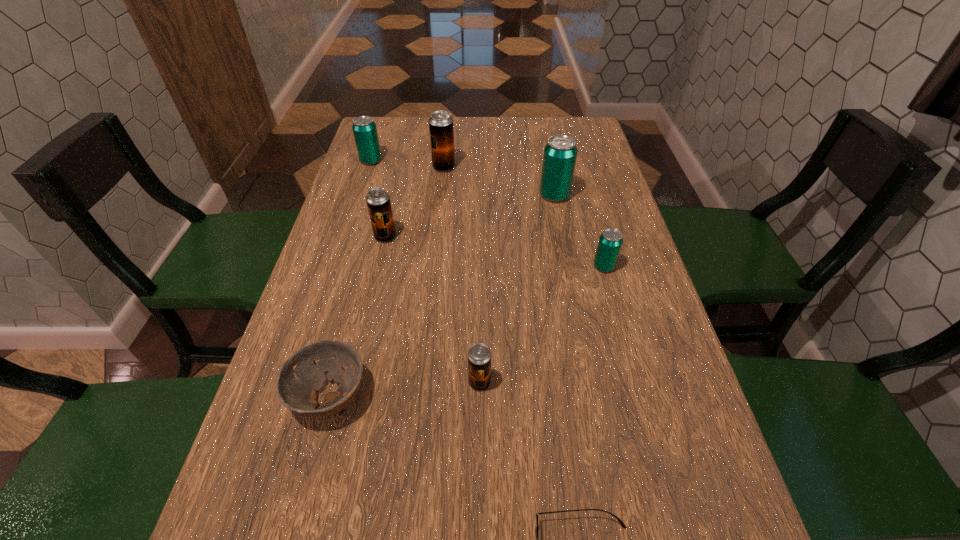
This screenshot has height=540, width=960. I want to click on the third beer can from right to left, so click(479, 355).

Where is `the nearest black beer can`? The height and width of the screenshot is (540, 960). the nearest black beer can is located at coordinates (479, 355).

Locate an element on the screen. bowl is located at coordinates (301, 376).

At what (x,y) coordinates should I click in order to perform the action: click on the seventh tallest object. Please return your answer as a coordinate pair (x, y). The height and width of the screenshot is (540, 960). Looking at the image, I should click on (301, 376).

Locate an element on the screen. The image size is (960, 540). blank space located on the right of the fifth object from right to left is located at coordinates (505, 167).

Where is `vacant space positioned 0.120m on the back of the fifth beer can from left to right`? vacant space positioned 0.120m on the back of the fifth beer can from left to right is located at coordinates (548, 164).

Find the location of a particular element. free space located on the back of the third nearest beer can is located at coordinates (405, 148).

Identify the location of vacant space located on the back of the second biggest teal beer can. The image size is (960, 540). (380, 133).

At what (x,y) coordinates should I click in order to perform the action: click on free space located on the left of the nearest teal beer can. Please return your answer as a coordinate pair (x, y). This screenshot has width=960, height=540. Looking at the image, I should click on (541, 267).

This screenshot has width=960, height=540. Find the location of `vacant region located on the right of the nearest beer can`. vacant region located on the right of the nearest beer can is located at coordinates (636, 382).